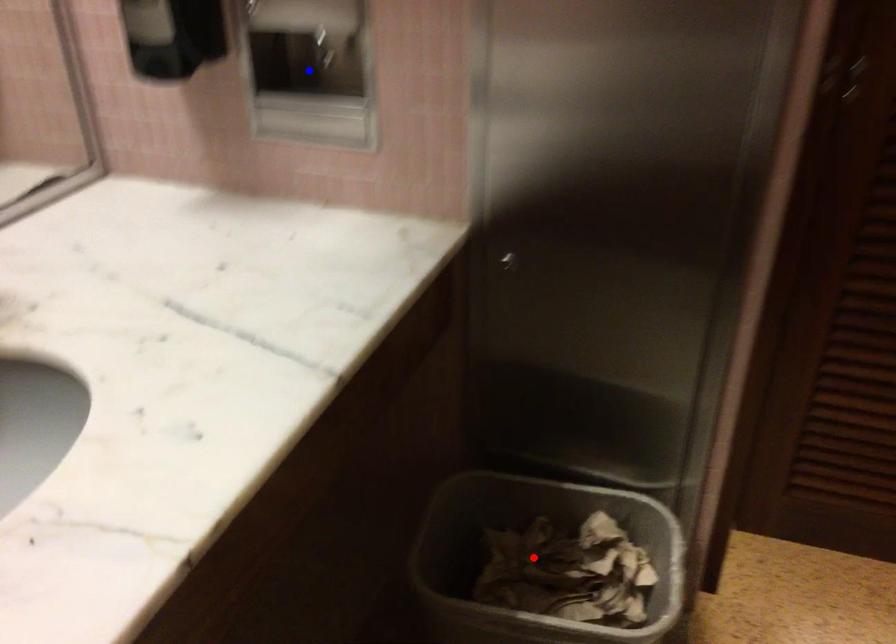
Question: Which of the two points in the image is closer to the camera?

Choices:
 (A) Blue point is closer.
 (B) Red point is closer.

Answer: (A)